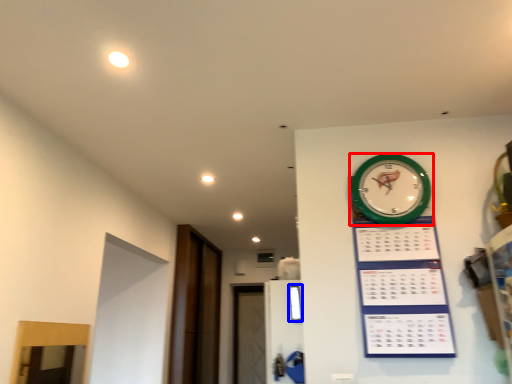
Question: Which object is further to the camera taking this photo, wall clock (highlighted by a red box) or window (highlighted by a blue box)?

Choices:
 (A) wall clock
 (B) window

Answer: (B)